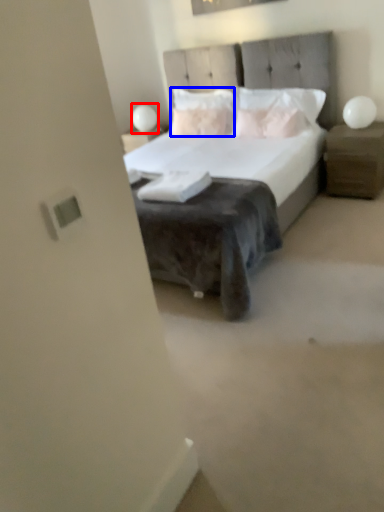
Question: Which of the following is the closest to the observer, table lamp (highlighted by a red box) or pillow (highlighted by a blue box)?

Choices:
 (A) table lamp
 (B) pillow

Answer: (B)